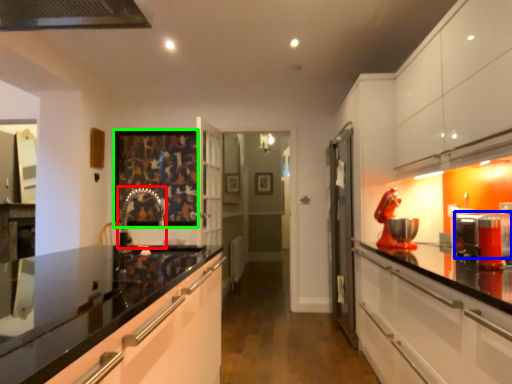
Question: Which object is the farthest from faucet (highlighted by a red box)? Choose among these: appliance (highlighted by a blue box) or picture frame (highlighted by a green box).

Choices:
 (A) appliance
 (B) picture frame

Answer: (A)